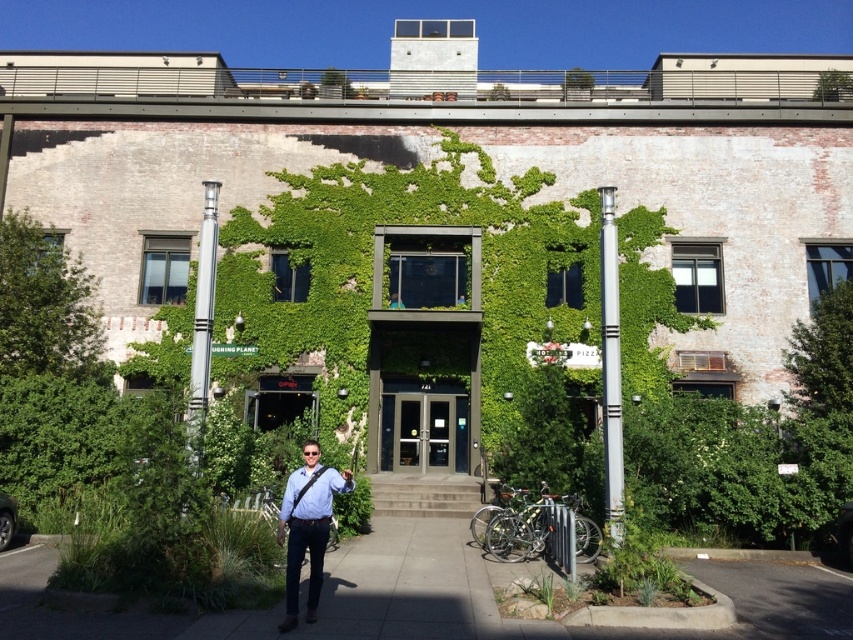
A man is standing at point (328, 516). The entrance is at point 0.5, 0.5. How far apart are they?

They are 25.42 feet apart.